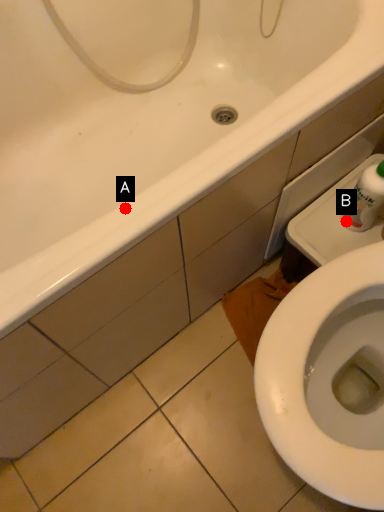
Question: Two points are circled on the image, labeled by A and B beside each circle. Which of the following is the closest to the observer?

Choices:
 (A) A is closer
 (B) B is closer

Answer: (A)